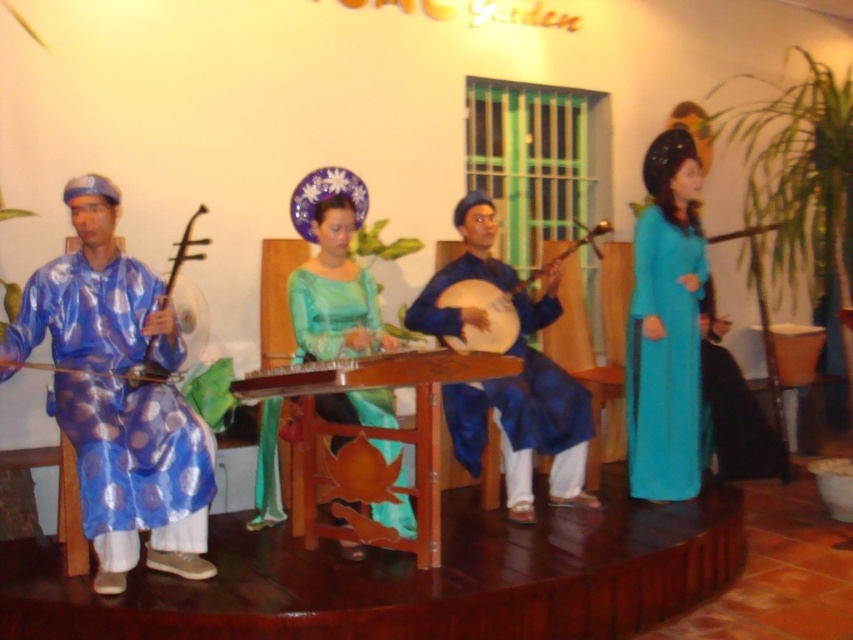
Who is more distant from viewer, (541, 387) or (374, 372)?

The point (541, 387) is behind.

Between point (506, 499) and point (440, 380), which one is positioned in front?

Positioned in front is point (440, 380).

Which is behind, point (453, 333) or point (352, 372)?

The point (453, 333) is more distant.

Where is `blue silk instrument at center`? This screenshot has height=640, width=853. blue silk instrument at center is located at coordinates (527, 413).

Who is more distant from viewer, (465, 260) or (84, 369)?

The point (465, 260) is behind.

Does blue silk instrument at center come behind matte blue wooden instrument at left?

Yes, it is.

I want to click on blue silk instrument at center, so click(x=527, y=413).

You are a GUI agent. You are given a task and a screenshot of the screen. Output one action in this format:
    pyautogui.click(x=<x>, y=<y>)
    Task: Click on the blue silk instrument at center
    
    Given the screenshot: What is the action you would take?
    pyautogui.click(x=527, y=413)

Does blue shiny robe at left appear under matte blue wooden instrument at left?

Correct, blue shiny robe at left is located below matte blue wooden instrument at left.

Is blue shiny robe at left taller than matte blue wooden instrument at left?

Correct, blue shiny robe at left is much taller as matte blue wooden instrument at left.

The image size is (853, 640). Identify the location of blue shiny robe at left. (136, 465).

You are a GUI agent. You are given a task and a screenshot of the screen. Output one action in this format:
    pyautogui.click(x=<x>, y=<y>)
    Task: Click on the blue shiny robe at left
    
    Given the screenshot: What is the action you would take?
    pyautogui.click(x=136, y=465)